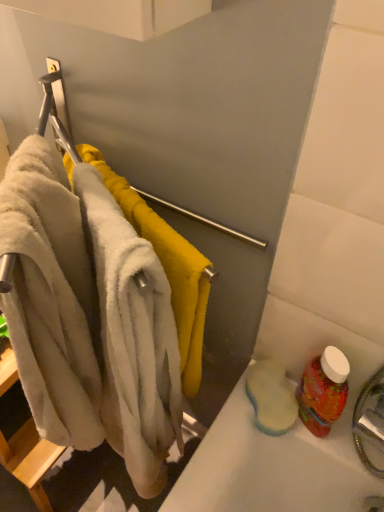
What is the approximate width of soft white towel at left?

soft white towel at left is 12.18 centimeters in width.

Describe the element at coordinates (323, 391) in the screenshot. I see `red plastic bottle at lower right` at that location.

Find the location of a particular element. Image resolution: width=384 pixels, height=512 pixels. soft white towel at left is located at coordinates (167, 267).

Could you tell me if soft white towel at left is turned towards beige fluffy bath towel at left?

Yes, soft white towel at left is oriented towards beige fluffy bath towel at left.

From the image's perspective, is soft white towel at left located above beige fluffy bath towel at left?

Correct, soft white towel at left appears higher than beige fluffy bath towel at left in the image.

Is soft white towel at left wider or thinner than beige fluffy bath towel at left?

Considering their sizes, soft white towel at left looks slimmer than beige fluffy bath towel at left.

From the picture: Visually, is soft white towel at left positioned to the left or to the right of beige fluffy bath towel at left?

Clearly, soft white towel at left is on the right of beige fluffy bath towel at left in the image.

Considering the sizes of soft white towel at left and red plastic bottle at lower right in the image, is soft white towel at left taller or shorter than red plastic bottle at lower right?

In the image, soft white towel at left appears to be taller than red plastic bottle at lower right.

Considering the sizes of objects soft white towel at left and red plastic bottle at lower right in the image provided, who is bigger, soft white towel at left or red plastic bottle at lower right?

With larger size is soft white towel at left.

Is soft white towel at left in contact with red plastic bottle at lower right?

No, soft white towel at left is not touching red plastic bottle at lower right.

Consider the image. Is soft white towel at left looking in the opposite direction of red plastic bottle at lower right?

soft white towel at left is not turned away from red plastic bottle at lower right.

Which is in front, red plastic bottle at lower right or beige fluffy bath towel at left?

Positioned in front is beige fluffy bath towel at left.

How different are the orientations of red plastic bottle at lower right and beige fluffy bath towel at left in degrees?

There is a 52.4-degree angle between the facing directions of red plastic bottle at lower right and beige fluffy bath towel at left.

Is red plastic bottle at lower right positioned beyond the bounds of beige fluffy bath towel at left?

Yes, red plastic bottle at lower right is not within beige fluffy bath towel at left.

Can you see red plastic bottle at lower right touching beige fluffy bath towel at left?

red plastic bottle at lower right is not next to beige fluffy bath towel at left, and they're not touching.

Which of these two, beige fluffy bath towel at left or soft white towel at left, stands shorter?

soft white towel at left.

From a real-world perspective, which object rests below the other?

beige fluffy bath towel at left.

Is beige fluffy bath towel at left looking in the opposite direction of soft white towel at left?

Yes, beige fluffy bath towel at left is facing away from soft white towel at left.

Is beige fluffy bath towel at left not near soft white towel at left?

No, beige fluffy bath towel at left is not far from soft white towel at left.

Is beige fluffy bath towel at left to the left of red plastic bottle at lower right from the viewer's perspective?

Yes, beige fluffy bath towel at left is to the left of red plastic bottle at lower right.

How different are the orientations of beige fluffy bath towel at left and red plastic bottle at lower right in degrees?

The angular difference between beige fluffy bath towel at left and red plastic bottle at lower right is 52.4 degrees.

From a real-world perspective, is beige fluffy bath towel at left on top of red plastic bottle at lower right?

Indeed, from a real-world perspective, beige fluffy bath towel at left stands above red plastic bottle at lower right.

Which of these two, beige fluffy bath towel at left or red plastic bottle at lower right, stands taller?

Standing taller between the two is beige fluffy bath towel at left.

From the image's perspective, is red plastic bottle at lower right located beneath soft white towel at left?

Indeed, from the image's perspective, red plastic bottle at lower right is shown beneath soft white towel at left.

In terms of height, does red plastic bottle at lower right look taller or shorter compared to soft white towel at left?

Clearly, red plastic bottle at lower right is shorter compared to soft white towel at left.

Is red plastic bottle at lower right facing away from soft white towel at left?

red plastic bottle at lower right does not have its back to soft white towel at left.

Does red plastic bottle at lower right have a greater width compared to soft white towel at left?

No, red plastic bottle at lower right is not wider than soft white towel at left.

Image resolution: width=384 pixels, height=512 pixels. Identify the location of towel that is behind the beige fluffy bath towel at left. (167, 267).

You are a GUI agent. You are given a task and a screenshot of the screen. Output one action in this format:
    pyautogui.click(x=<x>, y=<y>)
    Task: Click on the cleaning product below the soft white towel at left (from the image's perspective)
    The height and width of the screenshot is (512, 384).
    Given the screenshot: What is the action you would take?
    pyautogui.click(x=323, y=391)

Based on their spatial positions, is red plastic bottle at lower right or beige fluffy bath towel at left closer to soft white towel at left?

A: Based on the image, beige fluffy bath towel at left appears to be nearer to soft white towel at left.

From the picture: From the image, which object appears to be farther from red plastic bottle at lower right, soft white towel at left or beige fluffy bath towel at left?

beige fluffy bath towel at left is further to red plastic bottle at lower right.

Looking at the image, which one is located further to beige fluffy bath towel at left, soft white towel at left or red plastic bottle at lower right?

red plastic bottle at lower right lies further to beige fluffy bath towel at left than the other object.

From the image, which object appears to be farther from soft white towel at left, beige fluffy bath towel at left or red plastic bottle at lower right?

red plastic bottle at lower right is positioned further to the anchor soft white towel at left.

When comparing their distances from beige fluffy bath towel at left, does red plastic bottle at lower right or soft white towel at left seem further?

Among the two, red plastic bottle at lower right is located further to beige fluffy bath towel at left.

Estimate the real-world distances between objects in this image. Which object is closer to red plastic bottle at lower right, beige fluffy bath towel at left or soft white towel at left?

Among the two, soft white towel at left is located nearer to red plastic bottle at lower right.

Identify the location of towel between beige fluffy bath towel at left and red plastic bottle at lower right in the horizontal direction. (167, 267).